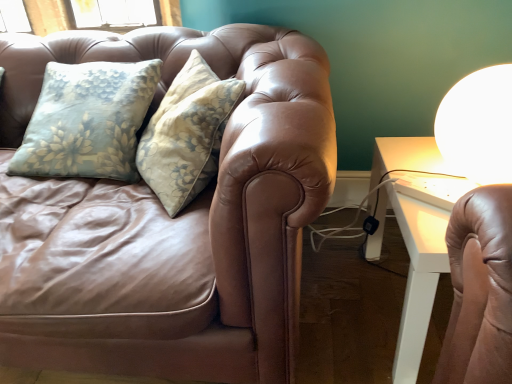
Measure the distance between white glossy table lamp at upper right and camera.

white glossy table lamp at upper right is 33.58 inches away from camera.

Find the location of a particular element. The image size is (512, 384). white glossy table lamp at upper right is located at coordinates (478, 125).

What do you see at coordinates (478, 125) in the screenshot? I see `white glossy table lamp at upper right` at bounding box center [478, 125].

Image resolution: width=512 pixels, height=384 pixels. Find the location of `leather couch at left`. leather couch at left is located at coordinates (191, 217).

Describe the element at coordinates (191, 217) in the screenshot. I see `leather couch at left` at that location.

What is the approximate width of leather couch at left?

The width of leather couch at left is 38.79 inches.

You are a GUI agent. You are given a task and a screenshot of the screen. Output one action in this format:
    pyautogui.click(x=<x>, y=<y>)
    Task: Click on the white glossy table lamp at upper right
    This screenshot has width=512, height=384.
    Given the screenshot: What is the action you would take?
    pyautogui.click(x=478, y=125)

Is white glossy table lamp at upper right at the right side of leather couch at left?

Indeed, white glossy table lamp at upper right is positioned on the right side of leather couch at left.

Considering their positions, is white glossy table lamp at upper right located in front of or behind leather couch at left?

white glossy table lamp at upper right is positioned farther from the viewer than leather couch at left.

Does point (482, 127) lie behind point (260, 294)?

That is True.

From the image's perspective, is white glossy table lamp at upper right under leather couch at left?

No.

From a real-world perspective, between white glossy table lamp at upper right and leather couch at left, who is vertically higher?

From a 3D spatial view, white glossy table lamp at upper right is above.

Can you confirm if white glossy table lamp at upper right is wider than leather couch at left?

No, white glossy table lamp at upper right is not wider than leather couch at left.

Which of these two, white glossy table lamp at upper right or leather couch at left, stands shorter?

Standing shorter between the two is white glossy table lamp at upper right.

Is white glossy table lamp at upper right bigger than leather couch at left?

Actually, white glossy table lamp at upper right might be smaller than leather couch at left.

Which is correct: white glossy table lamp at upper right is inside leather couch at left, or outside of it?

The correct answer is: outside.

Is white glossy table lamp at upper right beside leather couch at left?

white glossy table lamp at upper right and leather couch at left are not in contact.

Is white glossy table lamp at upper right facing away from leather couch at left?

No, white glossy table lamp at upper right's orientation is not away from leather couch at left.

Find the location of a particular element. The width and height of the screenshot is (512, 384). studio couch on the left of white glossy table lamp at upper right is located at coordinates (191, 217).

Which is more to the left, leather couch at left or white glossy table lamp at upper right?

From the viewer's perspective, leather couch at left appears more on the left side.

Relative to white glossy table lamp at upper right, is leather couch at left in front or behind?

Visually, leather couch at left is located in front of white glossy table lamp at upper right.

Between point (232, 177) and point (504, 179), which one is positioned behind?

Point (504, 179)

From the image's perspective, is leather couch at left on top of white glossy table lamp at upper right?

No, from the image's perspective, leather couch at left is not on top of white glossy table lamp at upper right.

From a real-world perspective, is leather couch at left positioned under white glossy table lamp at upper right based on gravity?

Yes, from a real-world perspective, leather couch at left is beneath white glossy table lamp at upper right.

Based on the photo, which object is wider, leather couch at left or white glossy table lamp at upper right?

Wider between the two is leather couch at left.

Considering the relative sizes of leather couch at left and white glossy table lamp at upper right in the image provided, is leather couch at left taller than white glossy table lamp at upper right?

Yes, leather couch at left is taller than white glossy table lamp at upper right.

Considering the sizes of objects leather couch at left and white glossy table lamp at upper right in the image provided, who is bigger, leather couch at left or white glossy table lamp at upper right?

Result: leather couch at left is bigger.

Do you think leather couch at left is within white glossy table lamp at upper right, or outside of it?

leather couch at left is not enclosed by white glossy table lamp at upper right.

Are leather couch at left and white glossy table lamp at upper right making contact?

There is a gap between leather couch at left and white glossy table lamp at upper right.

Is leather couch at left oriented towards white glossy table lamp at upper right?

No, leather couch at left is not turned towards white glossy table lamp at upper right.

Locate an element on the screen. The width and height of the screenshot is (512, 384). studio couch that appears on the left of white glossy table lamp at upper right is located at coordinates (191, 217).

Where is `table lamp above the leather couch at left (from a real-world perspective)`? The height and width of the screenshot is (384, 512). table lamp above the leather couch at left (from a real-world perspective) is located at coordinates (478, 125).

In order to click on table lamp on the right of the leather couch at left in this screenshot , I will do `click(478, 125)`.